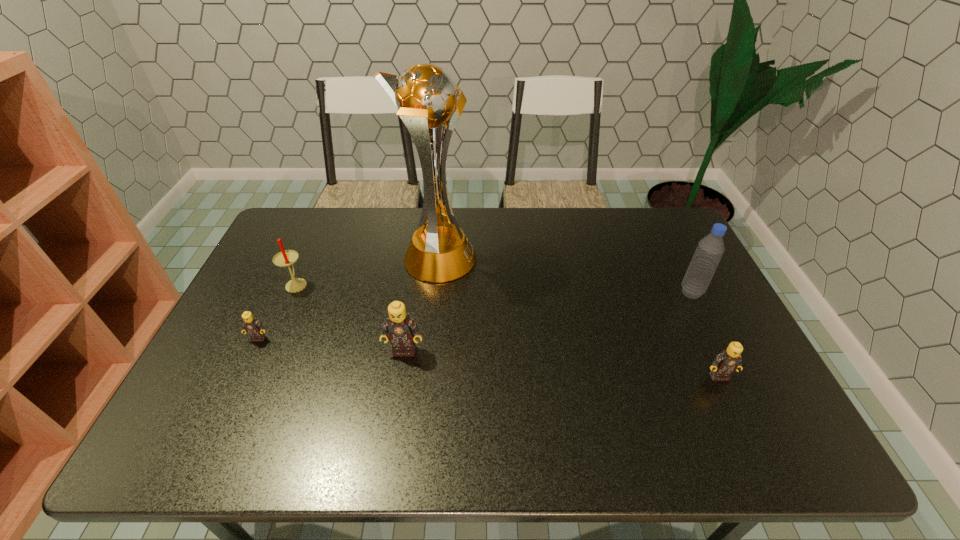
Image resolution: width=960 pixels, height=540 pixels. Find the location of `the third closest Lego relative to the tallest object`. the third closest Lego relative to the tallest object is located at coordinates (728, 361).

Identify the location of vacant space that satisfies the following two spatial constraints: 1. on the front-facing side of the trophy; 2. in front of the fifth farthest object. The width and height of the screenshot is (960, 540). (428, 350).

Identify the location of free space that satisfies the following two spatial constraints: 1. on the back side of the fifth shortest object; 2. on the front-facing side of the trophy. (675, 260).

At what (x,y) coordinates should I click in order to perform the action: click on free point that satisfies the following two spatial constraints: 1. on the front-facing side of the trophy; 2. in front of the fourth farthest object. Please return your answer as a coordinate pair (x, y). Looking at the image, I should click on (429, 338).